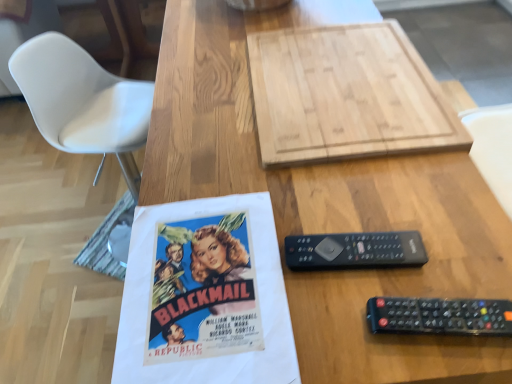
Where is `free space in front of natural wood cutting board at upper center`? The image size is (512, 384). free space in front of natural wood cutting board at upper center is located at coordinates (338, 232).